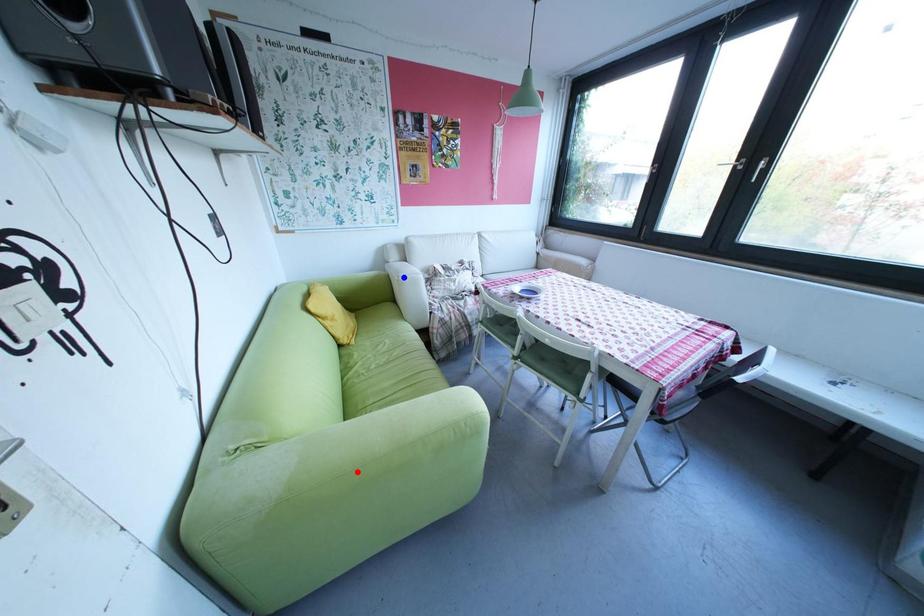
Question: Which of the two points in the image is closer to the camera?

Choices:
 (A) Blue point is closer.
 (B) Red point is closer.

Answer: (B)